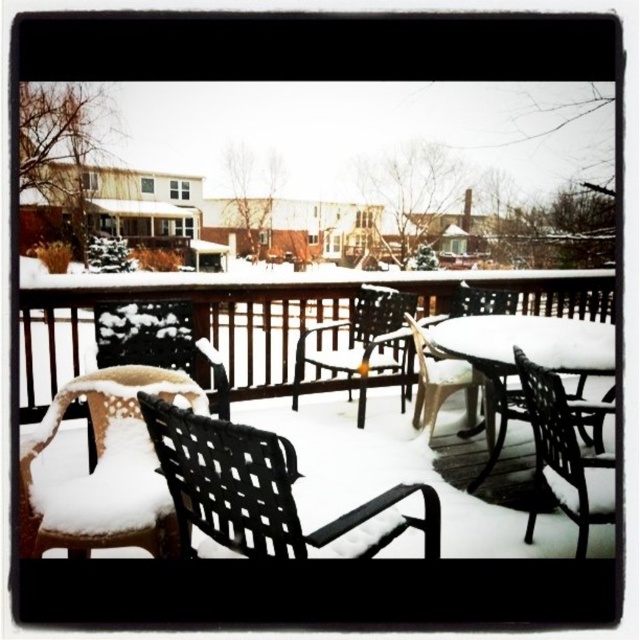
You are standing on the wooden deck and want to move from the black woven chair at lower right to the white plastic table at center. Can you walk directly to it without moving around the table?

The black woven chair at lower right is behind the white plastic table at center, so you would need to walk around the table to reach it from your current position.

You are standing on the wooden deck and want to sit down. You see the white plastic table at center and the black woven chair at lower right. Which object is directly under the table?

The black woven chair at lower right is directly under the white plastic table at center because the table is positioned over the chair.

You are standing on the wooden deck and want to move from the black woven chair at lower right to the white plastic table at center. Which direction should you move to reach the table?

The white plastic table at center is to the right of the black woven chair at lower right, so you should move to the right to reach the table.